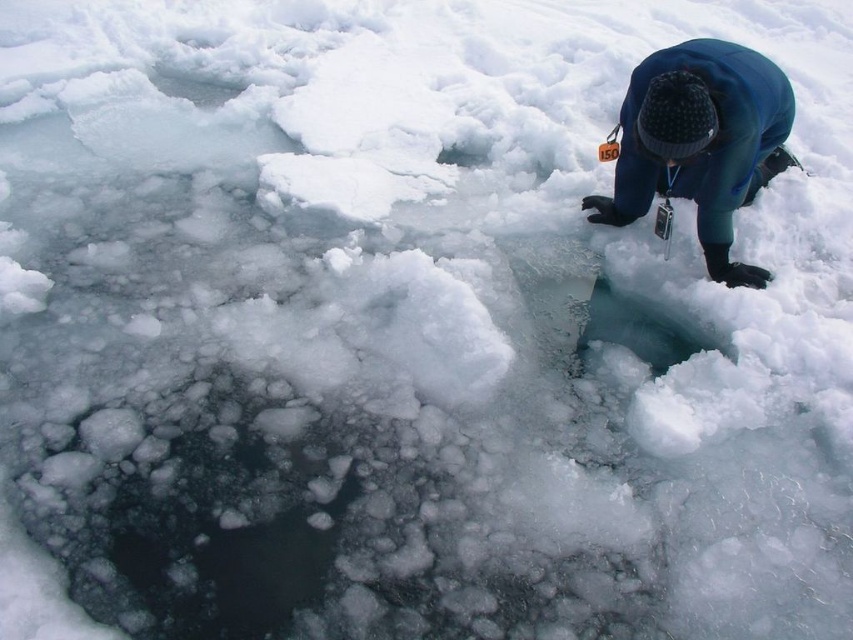
Question: Can you confirm if blue fleece jacket at upper right is bigger than transparent ice hole at center?

Choices:
 (A) yes
 (B) no

Answer: (A)

Question: Does blue fleece jacket at upper right come behind transparent ice hole at center?

Choices:
 (A) yes
 (B) no

Answer: (B)

Question: Which point is closer to the camera taking this photo?

Choices:
 (A) (457, 152)
 (B) (700, 49)

Answer: (B)

Question: Can you confirm if blue fleece jacket at upper right is positioned to the left of transparent ice hole at center?

Choices:
 (A) no
 (B) yes

Answer: (A)